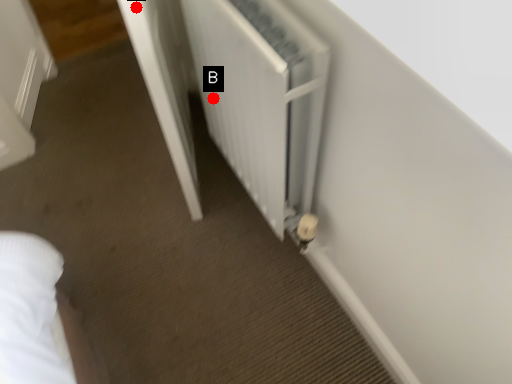
Question: Two points are circled on the image, labeled by A and B beside each circle. Which point is closer to the camera?

Choices:
 (A) A is closer
 (B) B is closer

Answer: (A)